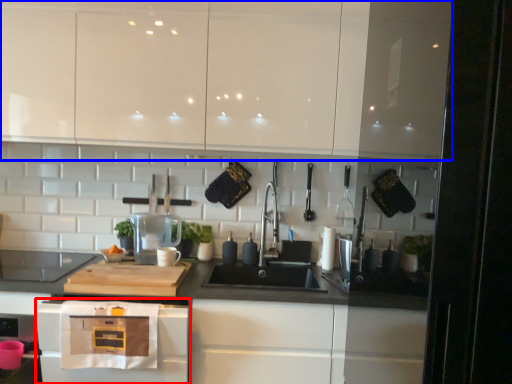
Question: Which point is closer to the camera, home appliance (highlighted by a red box) or cabinetry (highlighted by a blue box)?

Choices:
 (A) home appliance
 (B) cabinetry

Answer: (A)